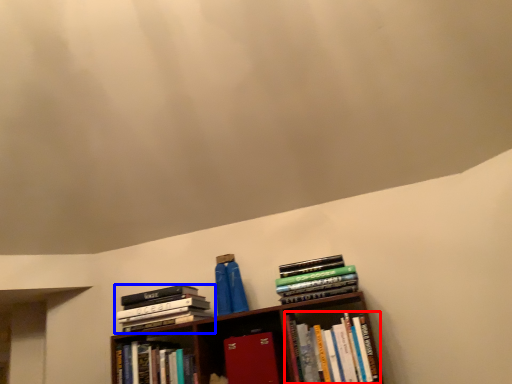
Question: Which object appears closest to the camera in this image, book (highlighted by a red box) or book (highlighted by a blue box)?

Choices:
 (A) book
 (B) book

Answer: (A)